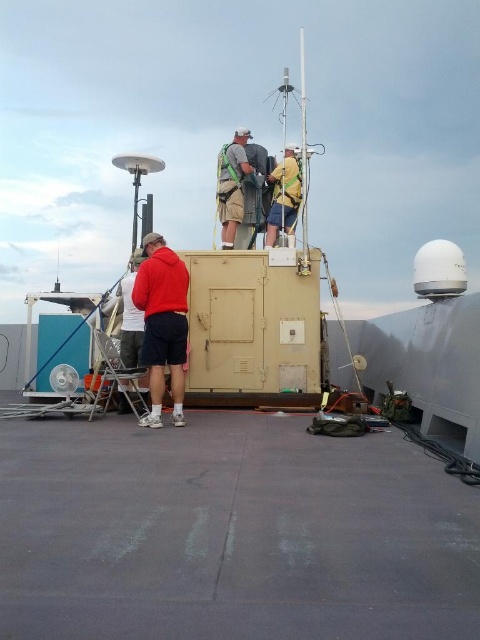
Who is taller, matte red hoodie at center or khaki shorts at center?

matte red hoodie at center is taller.

The height and width of the screenshot is (640, 480). What are the coordinates of `matte red hoodie at center` in the screenshot? It's located at (163, 324).

Can you confirm if gray rubber deck at center is positioned to the left of matte red hoodie at center?

In fact, gray rubber deck at center is to the right of matte red hoodie at center.

Where is `gray rubber deck at center`? The height and width of the screenshot is (640, 480). gray rubber deck at center is located at coordinates (230, 532).

At what (x,y) coordinates should I click in order to perform the action: click on gray rubber deck at center. Please return your answer as a coordinate pair (x, y). The width and height of the screenshot is (480, 640). Looking at the image, I should click on (230, 532).

Which of these two, khaki shorts at center or matte red jacket at lower left, stands taller?

With more height is matte red jacket at lower left.

Is point (241, 172) less distant than point (129, 308)?

That is False.

Identify the location of khaki shorts at center. Image resolution: width=480 pixels, height=640 pixels. (231, 186).